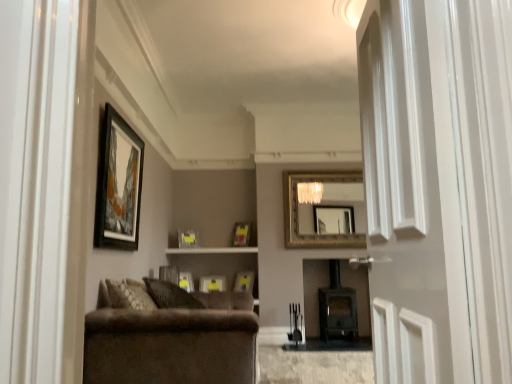
Question: Considering the relative sizes of matte wood shelf at center and matte black picture frame at center, which ranks as the sixth picture frame in back-to-front order, in the image provided, is matte wood shelf at center smaller than matte black picture frame at center, which ranks as the sixth picture frame in back-to-front order,?

Choices:
 (A) yes
 (B) no

Answer: (B)

Question: Does matte wood shelf at center have a lesser height compared to matte black picture frame at center, placed as the second picture frame when sorted from front to back?

Choices:
 (A) no
 (B) yes

Answer: (B)

Question: Is matte wood shelf at center closer to the viewer compared to matte black picture frame at center, which ranks as the sixth picture frame in back-to-front order?

Choices:
 (A) yes
 (B) no

Answer: (B)

Question: Does matte wood shelf at center have a greater width compared to matte black picture frame at center, which ranks as the sixth picture frame in back-to-front order?

Choices:
 (A) yes
 (B) no

Answer: (A)

Question: Is matte wood shelf at center far away from matte black picture frame at center, which ranks as the sixth picture frame in back-to-front order?

Choices:
 (A) no
 (B) yes

Answer: (A)

Question: Based on their positions, is dark brown wood fireplace at center located to the left or right of gold-framed mirror at upper center?

Choices:
 (A) left
 (B) right

Answer: (B)

Question: From the image's perspective, is dark brown wood fireplace at center located above or below gold-framed mirror at upper center?

Choices:
 (A) above
 (B) below

Answer: (B)

Question: From a real-world perspective, is dark brown wood fireplace at center physically located above or below gold-framed mirror at upper center?

Choices:
 (A) below
 (B) above

Answer: (A)

Question: Looking at the image, does dark brown wood fireplace at center seem bigger or smaller compared to gold-framed mirror at upper center?

Choices:
 (A) small
 (B) big

Answer: (B)

Question: Considering the positions of velvet brown couch at lower left and matte black picture frame at center, which ranks as the sixth picture frame in back-to-front order, in the image, is velvet brown couch at lower left wider or thinner than matte black picture frame at center, which ranks as the sixth picture frame in back-to-front order,?

Choices:
 (A) thin
 (B) wide

Answer: (B)

Question: Is velvet brown couch at lower left taller or shorter than matte black picture frame at center, which ranks as the sixth picture frame in back-to-front order?

Choices:
 (A) short
 (B) tall

Answer: (B)

Question: Does point (117, 349) appear closer or farther from the camera than point (176, 281)?

Choices:
 (A) farther
 (B) closer

Answer: (B)

Question: From the image's perspective, is velvet brown couch at lower left located above or below matte black picture frame at center, placed as the second picture frame when sorted from front to back?

Choices:
 (A) below
 (B) above

Answer: (A)

Question: Based on their sizes in the image, would you say wooden picture frame at upper left, acting as the 7th picture frame starting from the back, is bigger or smaller than dark brown wood fireplace at center?

Choices:
 (A) small
 (B) big

Answer: (A)

Question: Considering their positions, is wooden picture frame at upper left, acting as the 7th picture frame starting from the back, located in front of or behind dark brown wood fireplace at center?

Choices:
 (A) front
 (B) behind

Answer: (A)